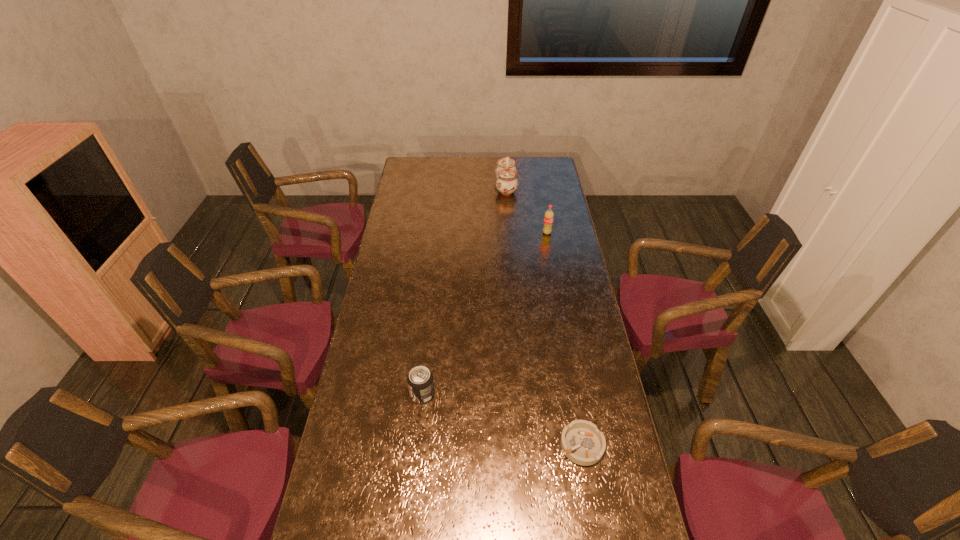
The height and width of the screenshot is (540, 960). In order to click on free space at the far right corner of the desktop in this screenshot , I will do coord(528,159).

Where is `vacant area that lies between the third object from right to left and the nearest object`? This screenshot has width=960, height=540. vacant area that lies between the third object from right to left and the nearest object is located at coordinates pyautogui.click(x=544, y=316).

Find the location of a particular element. The width and height of the screenshot is (960, 540). free space that is in between the chinaware and the third nearest object is located at coordinates (526, 210).

Identify the location of unoccupied position between the shortest object and the second shortest object. (502, 420).

Find the location of a particular element. The height and width of the screenshot is (540, 960). free space that is in between the leftmost object and the nearest object is located at coordinates (502, 420).

Where is `empty space that is in between the farthest object and the taller soda can`? Image resolution: width=960 pixels, height=540 pixels. empty space that is in between the farthest object and the taller soda can is located at coordinates (526, 210).

Image resolution: width=960 pixels, height=540 pixels. I want to click on blank region between the second farthest object and the second nearest object, so click(485, 313).

Locate an element on the screen. Image resolution: width=960 pixels, height=540 pixels. blank region between the ashtray and the third nearest object is located at coordinates (564, 339).

Locate an element on the screen. This screenshot has width=960, height=540. vacant area that lies between the third object from right to left and the nearer soda can is located at coordinates (465, 291).

Where is `free space between the nearest object and the third farthest object`? free space between the nearest object and the third farthest object is located at coordinates pos(502,420).